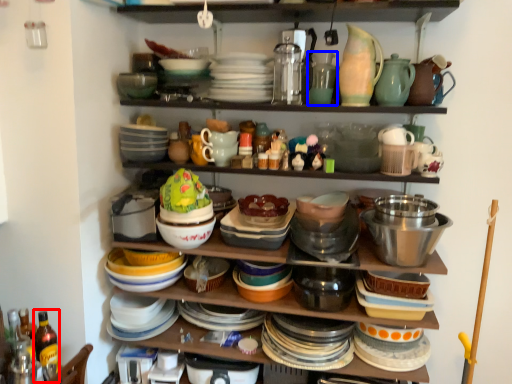
Question: Which object is closer to the camera taking this photo, bottle (highlighted by a red box) or tableware (highlighted by a blue box)?

Choices:
 (A) bottle
 (B) tableware

Answer: (A)